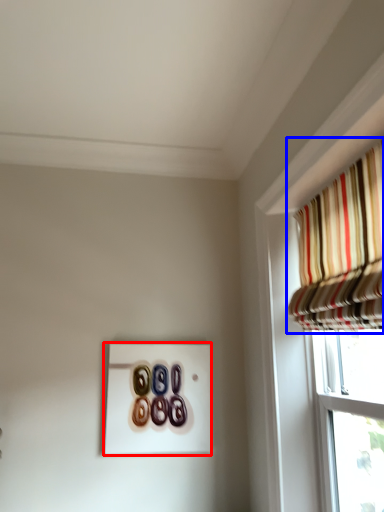
Question: Among these objects, which one is nearest to the camera, button (highlighted by a red box) or curtain (highlighted by a blue box)?

Choices:
 (A) button
 (B) curtain

Answer: (B)